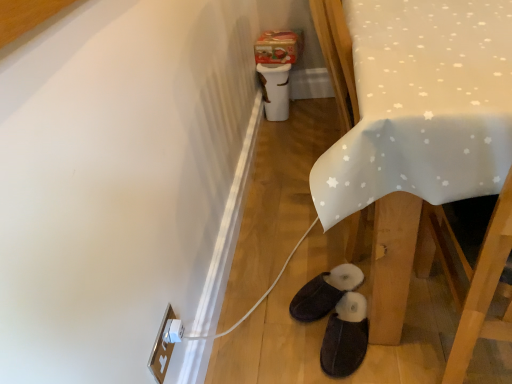
Image resolution: width=512 pixels, height=384 pixels. What are the coordinates of `vacant area located to the right-hand side of dark brown suede slippers at lower center, which ranks as the second footwear in back-to-front order` in the screenshot? It's located at (417, 336).